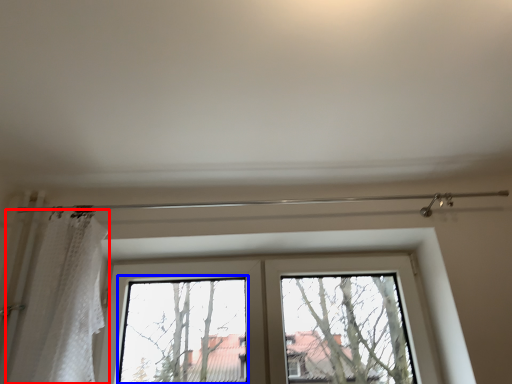
Question: Which object appears closest to the camera in this image, shower curtain (highlighted by a red box) or bay window (highlighted by a blue box)?

Choices:
 (A) shower curtain
 (B) bay window

Answer: (A)